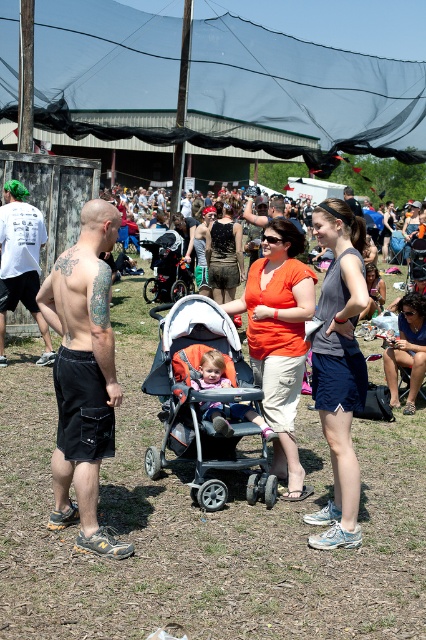
How far apart are black mesh canopy at upper center and black matte shorts at left?

black mesh canopy at upper center and black matte shorts at left are 32.16 meters apart from each other.

The height and width of the screenshot is (640, 426). I want to click on black mesh canopy at upper center, so click(305, 84).

Image resolution: width=426 pixels, height=640 pixels. I want to click on black mesh canopy at upper center, so click(305, 84).

Is the position of matte black dress at center more distant than that of soft pink fabric stroller at center?

Yes, it is.

Is matte black dress at center smaller than soft pink fabric stroller at center?

Incorrect, matte black dress at center is not smaller in size than soft pink fabric stroller at center.

Between point (212, 248) and point (238, 412), which one is positioned behind?

The point (212, 248) is behind.

Identify the location of matte black dress at center. This screenshot has width=426, height=640. (224, 253).

Is black mesh canopy at upper center taller than soft pink fabric stroller at center?

Yes.

Does black mesh canopy at upper center appear on the right side of soft pink fabric stroller at center?

Yes, black mesh canopy at upper center is to the right of soft pink fabric stroller at center.

Image resolution: width=426 pixels, height=640 pixels. What do you see at coordinates (305, 84) in the screenshot?
I see `black mesh canopy at upper center` at bounding box center [305, 84].

Identify the location of black mesh canopy at upper center. The width and height of the screenshot is (426, 640). (305, 84).